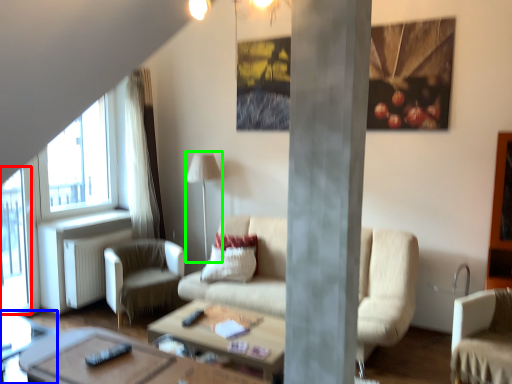
Question: Based on their relative distances, which object is farther from window screen (highlighted by a red box)? Choose from side table (highlighted by a blue box) and lamp (highlighted by a green box).

Choices:
 (A) side table
 (B) lamp

Answer: (B)